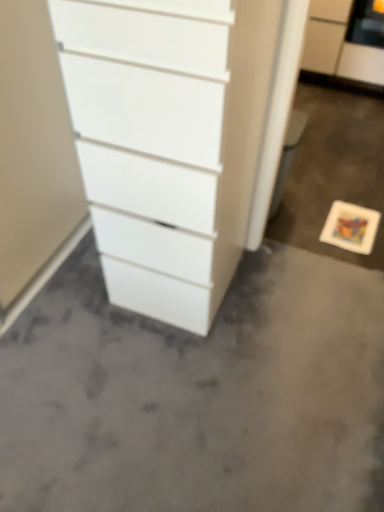
Question: Should I look upward or downward to see white matte filing cabinet at upper right?

Choices:
 (A) up
 (B) down

Answer: (A)

Question: From a real-world perspective, is white matte filing cabinet at upper right on top of gray matte concrete at center?

Choices:
 (A) no
 (B) yes

Answer: (B)

Question: From the image's perspective, is white matte filing cabinet at upper right on top of gray matte concrete at center?

Choices:
 (A) yes
 (B) no

Answer: (A)

Question: Can you confirm if white matte filing cabinet at upper right is taller than gray matte concrete at center?

Choices:
 (A) yes
 (B) no

Answer: (A)

Question: Considering the relative sizes of white matte filing cabinet at upper right and gray matte concrete at center in the image provided, is white matte filing cabinet at upper right wider than gray matte concrete at center?

Choices:
 (A) no
 (B) yes

Answer: (A)

Question: Can you confirm if white matte filing cabinet at upper right is smaller than gray matte concrete at center?

Choices:
 (A) yes
 (B) no

Answer: (B)

Question: Is white matte filing cabinet at upper right with gray matte concrete at center?

Choices:
 (A) no
 (B) yes

Answer: (A)

Question: Is the depth of gray matte concrete at center greater than that of white glossy chest of drawers at center?

Choices:
 (A) yes
 (B) no

Answer: (A)

Question: Is gray matte concrete at center shorter than white glossy chest of drawers at center?

Choices:
 (A) no
 (B) yes

Answer: (B)

Question: Is gray matte concrete at center positioned far away from white glossy chest of drawers at center?

Choices:
 (A) yes
 (B) no

Answer: (B)

Question: Is gray matte concrete at center to the left of white glossy chest of drawers at center from the viewer's perspective?

Choices:
 (A) yes
 (B) no

Answer: (B)

Question: From the image's perspective, is gray matte concrete at center located beneath white glossy chest of drawers at center?

Choices:
 (A) no
 (B) yes

Answer: (B)

Question: Is gray matte concrete at center with white glossy chest of drawers at center?

Choices:
 (A) yes
 (B) no

Answer: (B)

Question: From the image's perspective, is white glossy chest of drawers at center on top of gray matte concrete at center?

Choices:
 (A) yes
 (B) no

Answer: (A)